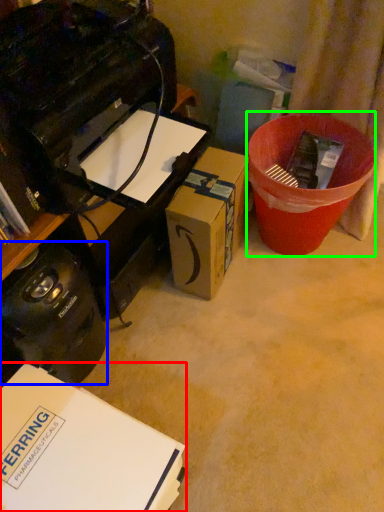
Question: Estimate the real-world distances between objects in this image. Which object is closer to box (highlighted by a red box), appliance (highlighted by a blue box) or recycling bin (highlighted by a green box)?

Choices:
 (A) appliance
 (B) recycling bin

Answer: (A)